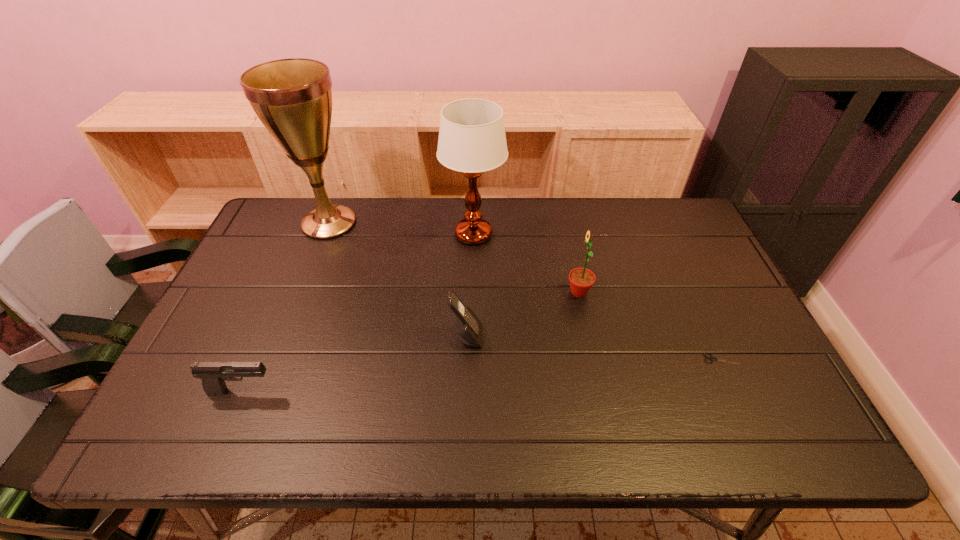
Find the location of `the closest object to the fifth tallest object`. the closest object to the fifth tallest object is located at coordinates (468, 326).

Image resolution: width=960 pixels, height=540 pixels. I want to click on vacant area in the image that satisfies the following two spatial constraints: 1. on the front-facing side of the third nearest object; 2. on the right side of the shortest object, so click(466, 359).

This screenshot has width=960, height=540. I want to click on vacant region that satisfies the following two spatial constraints: 1. on the front side of the table lamp; 2. aim along the barrel of the pistol, so click(x=471, y=391).